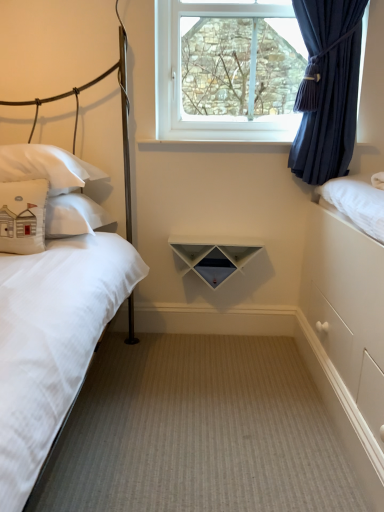
Locate an element on the screen. This screenshot has height=512, width=384. vacant area on top of beige carpet at center (from a real-world perspective) is located at coordinates (228, 394).